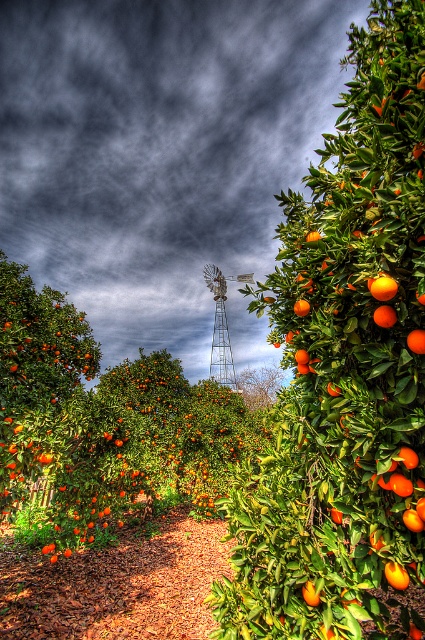
Question: Does brown mulch path at center have a lesser width compared to orange matte/orange at right?

Choices:
 (A) no
 (B) yes

Answer: (A)

Question: Which of the following is the farthest from the observer?

Choices:
 (A) (59, 636)
 (B) (252, 376)
 (C) (385, 573)

Answer: (B)

Question: Where is shiny orange fruit at right located in relation to glossy orange at right in the image?

Choices:
 (A) left
 (B) right

Answer: (B)

Question: Which point is farther to the camera?

Choices:
 (A) (175, 557)
 (B) (418, 336)
 (C) (391, 570)

Answer: (A)

Question: Is shiny orange fruit at right behind orange matte/orange at right?

Choices:
 (A) yes
 (B) no

Answer: (B)

Question: Which object is farther from the camera taking this photo?

Choices:
 (A) shiny orange fruit at right
 (B) brown mulch path at center
 (C) glossy orange at right

Answer: (B)